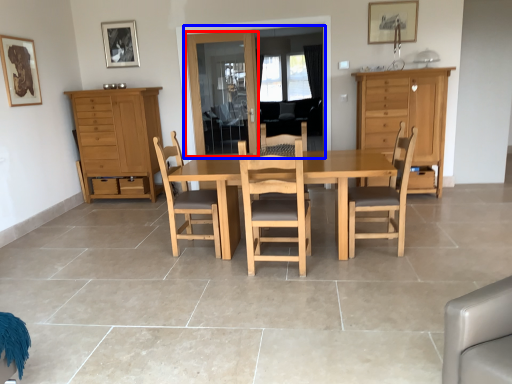
Question: Among these objects, which one is farthest to the camera, glass door (highlighted by a red box) or glass door (highlighted by a blue box)?

Choices:
 (A) glass door
 (B) glass door

Answer: (A)